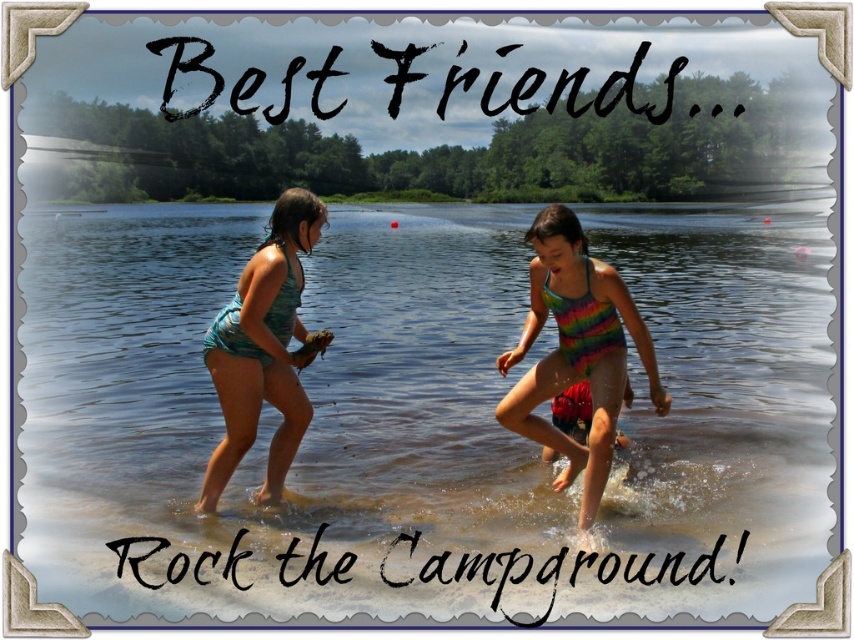
You are standing at the point labeled point (256, 524) and want to throw a ball to your friend who is at the other end of the lake. If the distance between you and your friend is 11.35 meters, can you successfully throw the ball to them?

Yes, because the distance between you and your friend is 11.35 meters, which is within a typical throwing range for a ball.

You are standing at the lakeside campsite and want to walk from point A to point B. Point A is located at coordinates point (x=613, y=305) and point B is at point (x=237, y=284). Which point should you start from to be closer to the water? Please choose between point A or point B.

Point A is further to the viewer than point B, so starting from point A would place you closer to the water since it is nearer to your current position.